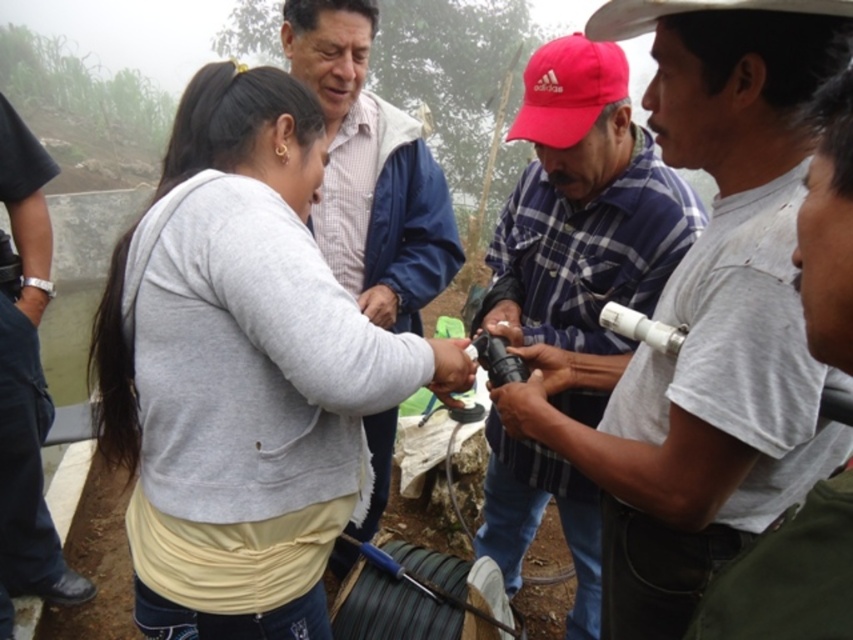
Can you confirm if plaid fabric shirt at center is taller than matte blue jacket at center?

Correct, plaid fabric shirt at center is much taller as matte blue jacket at center.

Is plaid fabric shirt at center further to camera compared to matte blue jacket at center?

Yes, it is.

Who is more distant from viewer, (572, 134) or (444, 260)?

Positioned behind is point (444, 260).

Where is `plaid fabric shirt at center`? Image resolution: width=853 pixels, height=640 pixels. plaid fabric shirt at center is located at coordinates (x=583, y=209).

Between light gray sweatshirt at center and matte blue jacket at center, which one appears on the right side from the viewer's perspective?

matte blue jacket at center is more to the right.

Which is in front, point (187, 129) or point (347, 12)?

Point (187, 129) is in front.

Image resolution: width=853 pixels, height=640 pixels. Find the location of `light gray sweatshirt at center`. light gray sweatshirt at center is located at coordinates (244, 374).

Where is `light gray sweatshirt at center`? This screenshot has height=640, width=853. light gray sweatshirt at center is located at coordinates (244, 374).

Can you confirm if matte blue jacket at center is positioned to the right of black leather watch at left?

Indeed, matte blue jacket at center is positioned on the right side of black leather watch at left.

Is matte blue jacket at center smaller than black leather watch at left?

Actually, matte blue jacket at center might be larger than black leather watch at left.

This screenshot has width=853, height=640. What do you see at coordinates (370, 172) in the screenshot? I see `matte blue jacket at center` at bounding box center [370, 172].

The image size is (853, 640). In order to click on matte blue jacket at center in this screenshot , I will do `click(370, 172)`.